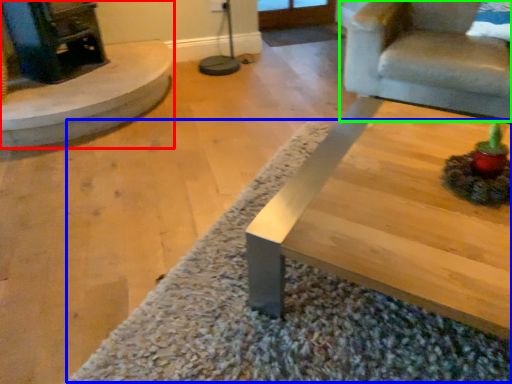
Question: Based on their relative distances, which object is farther from fireplace (highlighted by a red box)? Choose from mat (highlighted by a blue box) and chair (highlighted by a green box).

Choices:
 (A) mat
 (B) chair

Answer: (B)